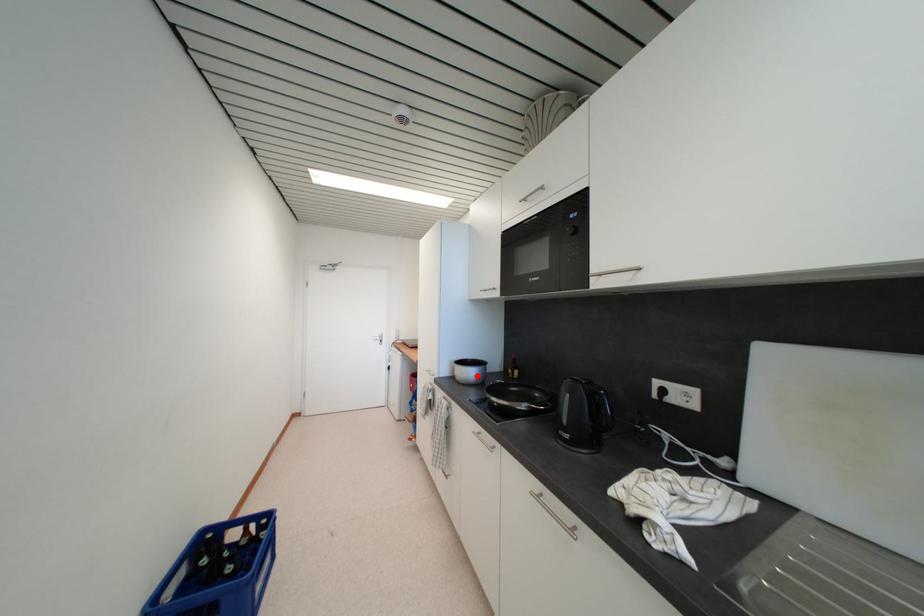
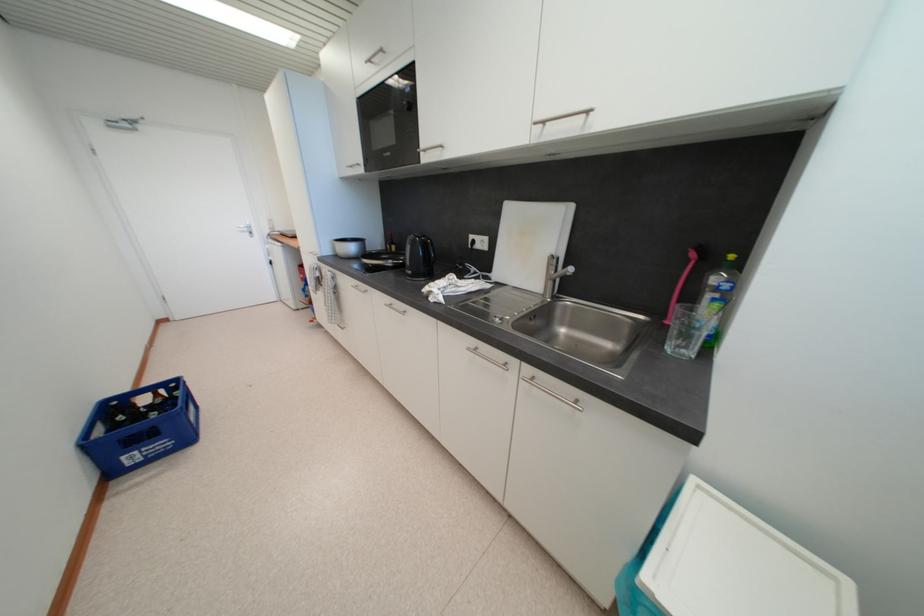
Find the pixel in the second image that matches the highlighted location in the first image.

(357, 251)